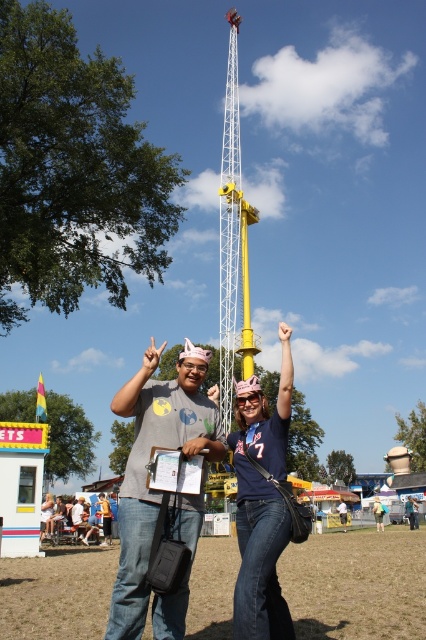
Question: Which object appears closest to the camera in this image?

Choices:
 (A) denim jeans at center
 (B) yellow metallic tower at center

Answer: (A)

Question: Is brown grass at lower center bigger than denim jeans at center?

Choices:
 (A) no
 (B) yes

Answer: (B)

Question: Is denim jeans at center positioned before yellow metallic tower at center?

Choices:
 (A) yes
 (B) no

Answer: (A)

Question: Is brown grass at lower center in front of yellow metallic tower at center?

Choices:
 (A) no
 (B) yes

Answer: (B)

Question: Which object is farther from the camera taking this photo?

Choices:
 (A) denim jeans at center
 (B) denim jeans at lower center

Answer: (B)

Question: Which point is closer to the camera?

Choices:
 (A) matte gray t-shirt at center
 (B) denim jeans at lower center

Answer: (A)